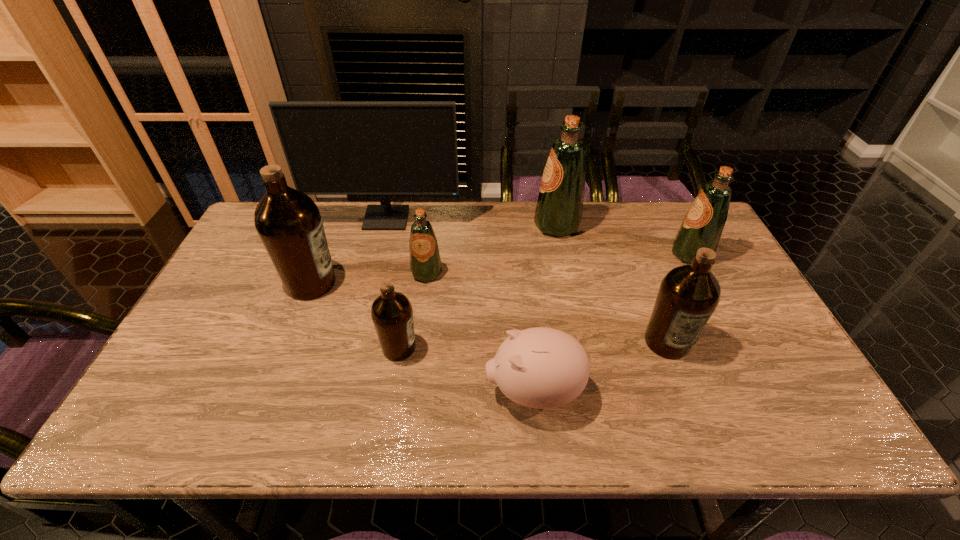
Where is `free space located 0.150m on the label of the seventh object from left to right`? This screenshot has width=960, height=540. free space located 0.150m on the label of the seventh object from left to right is located at coordinates (696, 419).

Locate an element on the screen. This screenshot has width=960, height=540. free spot located on the front-facing side of the smallest green olive oil is located at coordinates (420, 330).

The image size is (960, 540). Find the location of `free location located on the label of the smallest brown olive oil`. free location located on the label of the smallest brown olive oil is located at coordinates (473, 348).

At what (x,y) coordinates should I click in order to perform the action: click on vacant area situated 0.120m at the snout of the shortest object. Please return your answer as a coordinate pair (x, y). The width and height of the screenshot is (960, 540). Looking at the image, I should click on (433, 392).

Find the location of a particular element. vacant position located at the snout of the shortest object is located at coordinates (369, 392).

You are a GUI agent. You are given a task and a screenshot of the screen. Output one action in this format:
    pyautogui.click(x=<x>, y=<y>)
    Task: Click on the vacant space located at the snout of the shortest object
    The image size is (960, 540).
    Given the screenshot: What is the action you would take?
    pyautogui.click(x=417, y=392)

Where is `computer monitor positioned at the far edge`? computer monitor positioned at the far edge is located at coordinates (384, 148).

You are a GUI agent. You are given a task and a screenshot of the screen. Output one action in this format:
    pyautogui.click(x=<x>, y=<y>)
    Task: Click on the object that is at the near edge
    The width and height of the screenshot is (960, 540).
    Given the screenshot: What is the action you would take?
    pyautogui.click(x=541, y=368)

Identify the location of object that is at the right edge. This screenshot has width=960, height=540. (702, 227).

At what (x,y) coordinates should I click in order to perform the action: click on object situated at the far right corner. Please return your answer as a coordinate pair (x, y). Looking at the image, I should click on (702, 227).